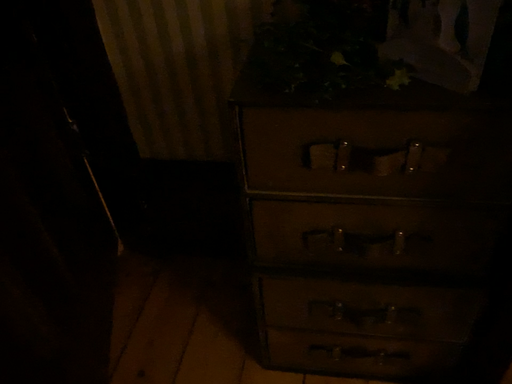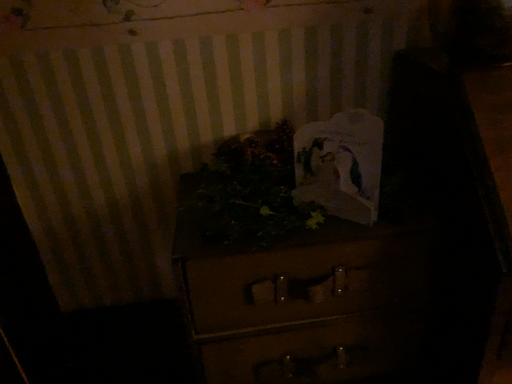
Question: How did the camera likely rotate when shooting the video?

Choices:
 (A) rotated downward
 (B) rotated upward

Answer: (B)